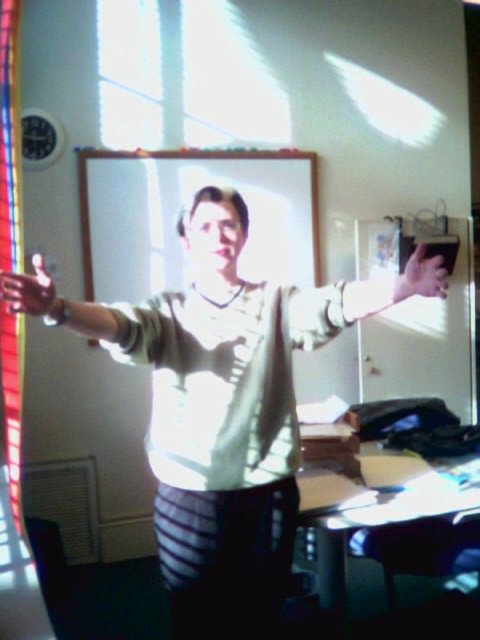
Question: Which point is farther to the camera?

Choices:
 (A) (399, 285)
 (B) (168, 589)
 (C) (112, 308)
 (D) (48, 292)

Answer: (B)

Question: Does white matte shirt at center come in front of matte skin hand at upper right?

Choices:
 (A) no
 (B) yes

Answer: (B)

Question: Based on their relative distances, which object is nearer to the matte black hand at left?

Choices:
 (A) white matte shirt at center
 (B) matte skin hand at upper right
 (C) matte white hand at upper right
 (D) matte white shirt at center

Answer: (D)

Question: Which of the following is the farthest from the observer?

Choices:
 (A) matte black hand at left
 (B) matte skin hand at upper right
 (C) white matte shirt at center
 (D) matte white shirt at center

Answer: (B)

Question: Does matte black hand at left have a smaller size compared to matte skin hand at upper right?

Choices:
 (A) yes
 (B) no

Answer: (B)

Question: Does white matte shirt at center appear over matte skin hand at upper right?

Choices:
 (A) no
 (B) yes

Answer: (A)